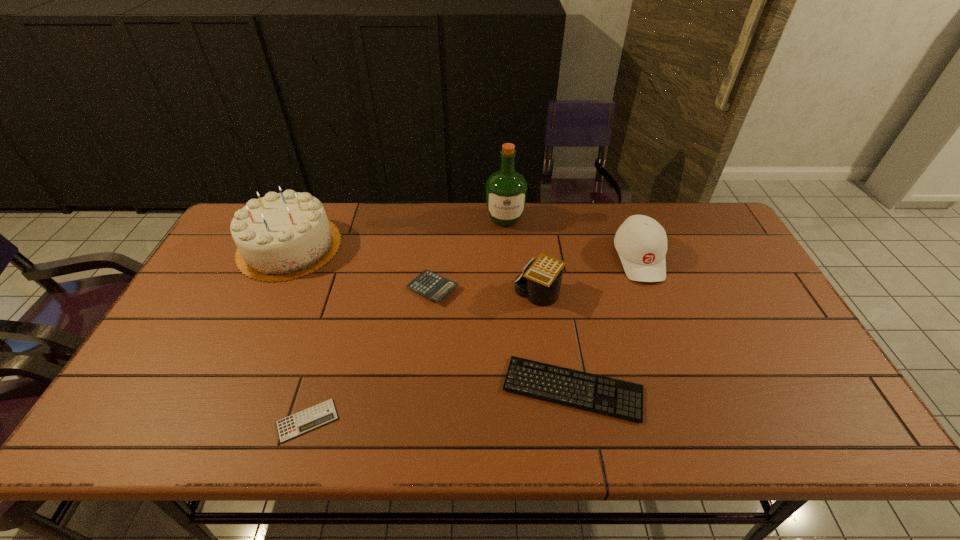
Find the location of a particular element. unoccupied position between the birthday cake and the second shortest calculator is located at coordinates (361, 267).

In order to click on vacant space in between the nearest calculator and the rightmost calculator in this screenshot , I will do `click(423, 357)`.

The image size is (960, 540). Identify the location of unoccupied area between the shortest calculator and the sixth tallest object. (440, 405).

Where is `free space between the computer keyboard and the baseball cap`? Image resolution: width=960 pixels, height=540 pixels. free space between the computer keyboard and the baseball cap is located at coordinates (606, 323).

Choose which object is the fifth nearest neighbor to the birthday cake. Please provide its 2D coordinates. Your answer should be formatted as a tuple, i.e. [(x, y)], where the tuple contains the x and y coordinates of a point satisfying the conditions above.

[(618, 398)]

Where is `object identified as the second closest to the second calculator from left to right`? The height and width of the screenshot is (540, 960). object identified as the second closest to the second calculator from left to right is located at coordinates (506, 190).

This screenshot has height=540, width=960. I want to click on calculator that is the second closest to the fifth tallest object, so click(323, 413).

Find the location of `calculator object that ranks as the closest to the tallest object`. calculator object that ranks as the closest to the tallest object is located at coordinates [x=428, y=284].

At what (x,y) coordinates should I click in order to perform the action: click on vacant region that satisfies the following two spatial constraints: 1. on the front-facing side of the rightmost calculator; 2. on the left side of the liquor. Please return your answer as a coordinate pair (x, y). Looking at the image, I should click on (510, 294).

Identify the location of vacant area that satisfies the following two spatial constraints: 1. on the front-facing side of the liquor; 2. on the left side of the tallest calculator. The width and height of the screenshot is (960, 540). (510, 294).